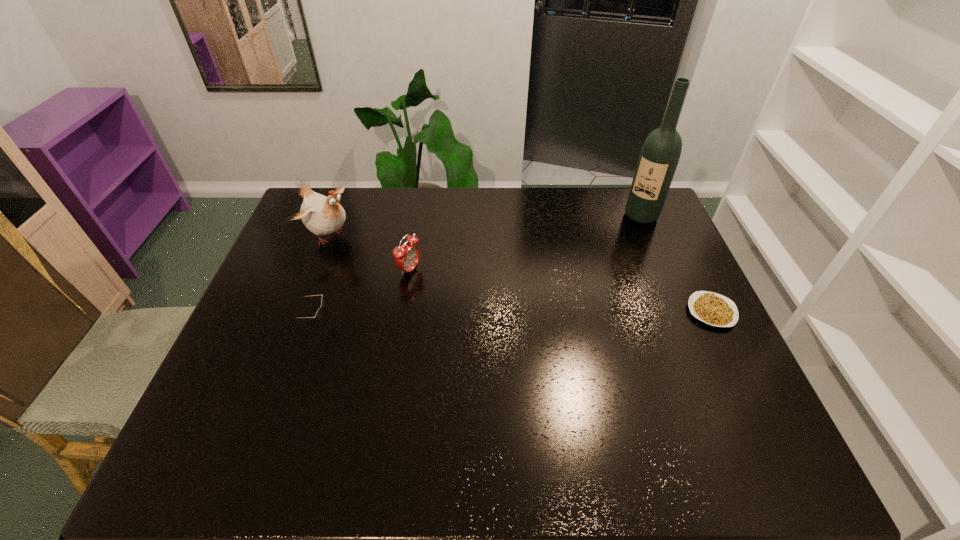
The image size is (960, 540). Find the location of `the second shortest object`. the second shortest object is located at coordinates (318, 314).

The width and height of the screenshot is (960, 540). In order to click on the shortest object in this screenshot , I will do `click(717, 310)`.

The image size is (960, 540). What are the coordinates of `the tallest object` in the screenshot? It's located at (661, 150).

In order to click on alarm clock in this screenshot , I will do `click(406, 256)`.

At what (x,y) coordinates should I click in order to perform the action: click on the third object from left to right. Please return your answer as a coordinate pair (x, y). This screenshot has width=960, height=540. Looking at the image, I should click on (406, 256).

I want to click on bird, so point(322,215).

In order to click on free region located in front of the lenses of the sunglasses in this screenshot , I will do `click(348, 323)`.

This screenshot has height=540, width=960. I want to click on vacant space positioned on the left of the legume, so click(x=665, y=312).

The height and width of the screenshot is (540, 960). In order to click on vacant area situated on the labeled side of the tallest object in this screenshot , I will do `click(623, 240)`.

The image size is (960, 540). Find the location of `vacant space positioned 0.190m on the labeled side of the tallest object`. vacant space positioned 0.190m on the labeled side of the tallest object is located at coordinates (612, 255).